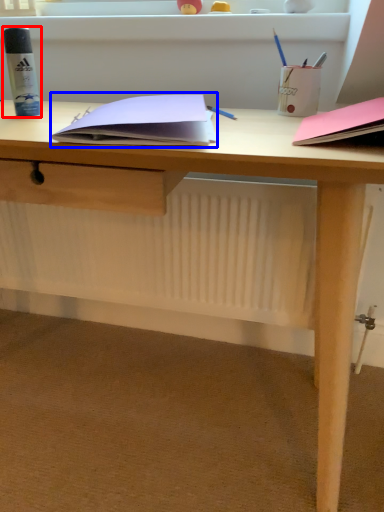
Question: Which of the following is the farthest to the observer, stationery (highlighted by a red box) or paperback book (highlighted by a blue box)?

Choices:
 (A) stationery
 (B) paperback book

Answer: (A)